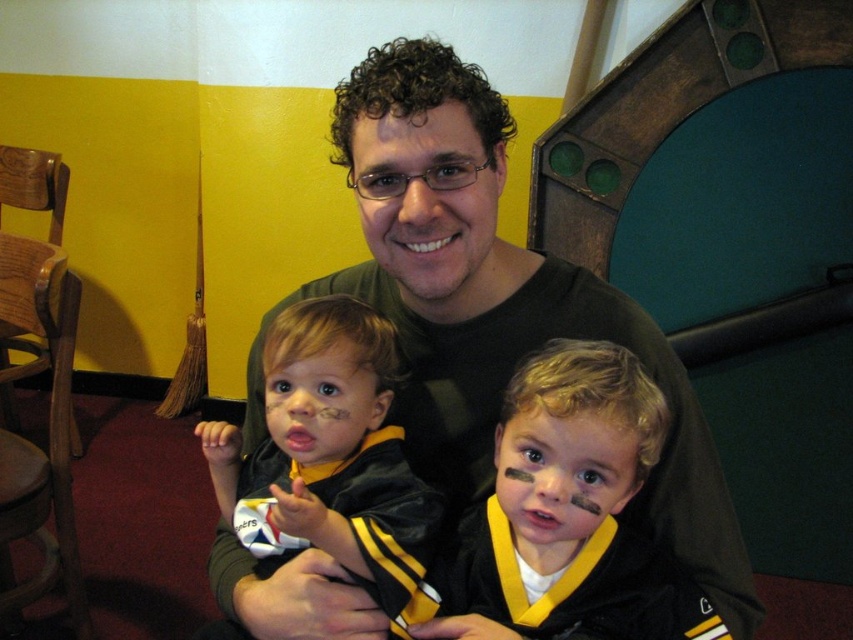
You are trying to decide which clothing item to take for a casual day out. Based on the image, which one between the black matte shirt at center and the matte black jacket at center is bigger in size?

The black matte shirt at center is larger in size compared to the matte black jacket at center.

You are standing in front of the image. The black matte shirt at center is part of the adult male. If you want to hand him a small object, can you reach him without moving closer?

The distance between you and the black matte shirt at center is 27.26 inches. Since this distance is greater than typical reaching range, you would need to move closer to hand him the object.

Based on the scene description, which object is taller between the black matte shirt at center and the matte black jacket at center?

The black matte shirt at center is much taller than the matte black jacket at center.